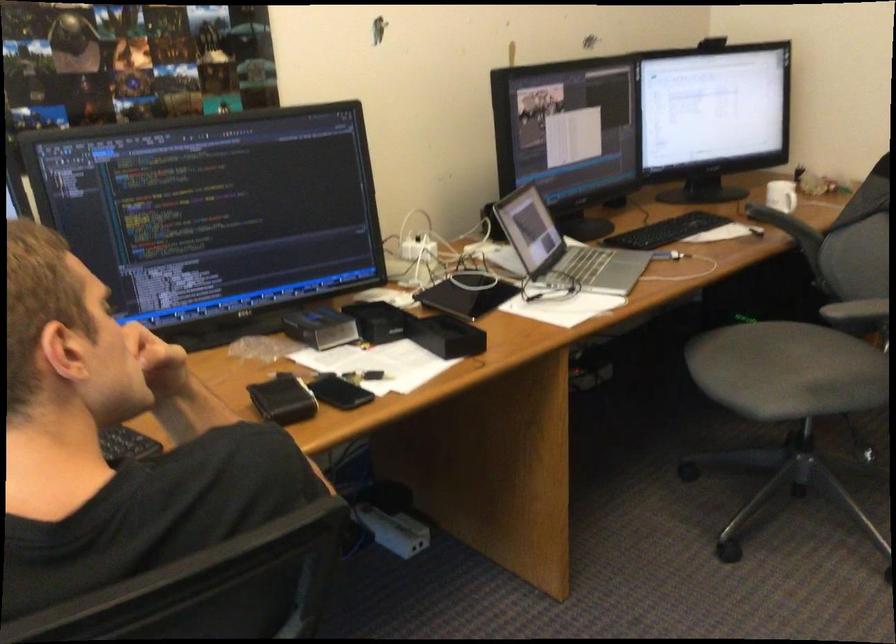
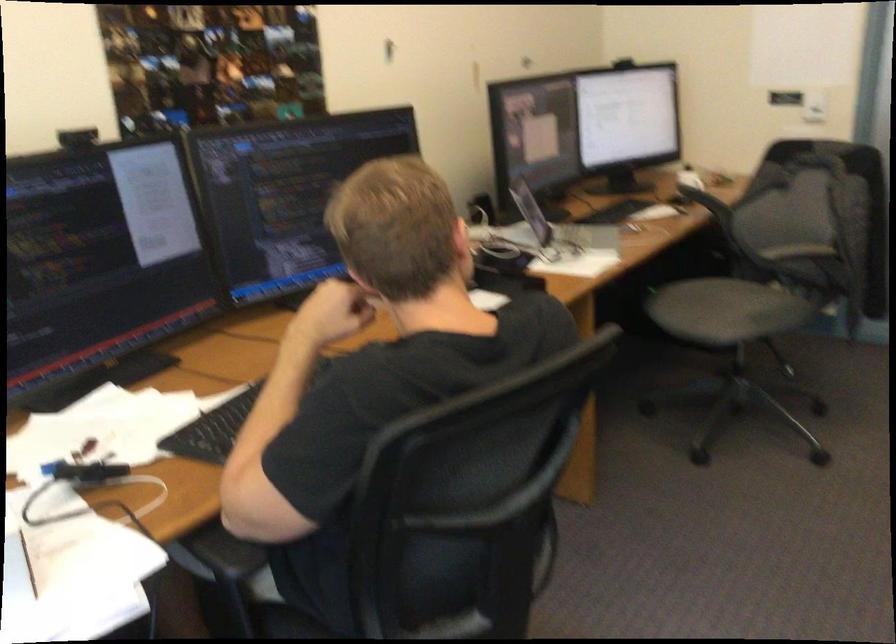
In the second image, find the point that corresponds to pixel 572 261 in the first image.

(561, 230)